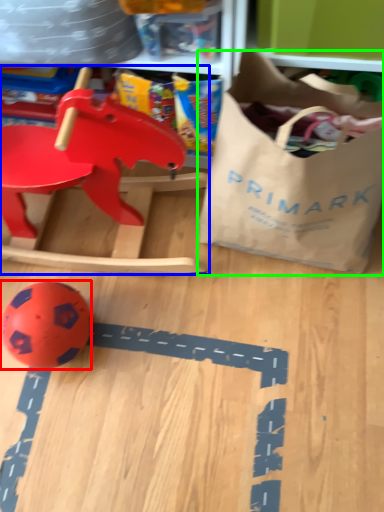
Question: Which object is positioned closest to toy (highlighted by a red box)? Select from toy (highlighted by a blue box) and grocery bag (highlighted by a green box).

Choices:
 (A) toy
 (B) grocery bag

Answer: (A)